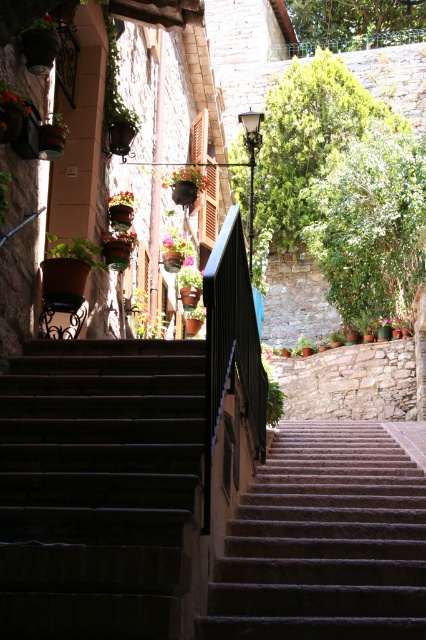
From the picture: You are standing at the base of the narrow stone staircase in the image. You want to take a photo of the green matte plant at left with your camera. The camera has a maximum zoom range of 50 feet. Can you capture the plant without moving closer?

The green matte plant at left and camera are 78.11 feet apart from each other. Since the camera can only zoom up to 50 feet, you cannot capture the plant without moving closer.

You are a gardener who needs to transport both the green matte plant at left and the matte orange flower pot at center to a storage room located at the bottom of the narrow stone staircase. Considering their sizes, which object should you carry first to ensure you can navigate the narrow staircase safely?

The green matte plant at left is smaller in size compared to the matte orange flower pot at center. Therefore, you should carry the green matte plant at left first to navigate the narrow staircase safely, as it takes up less space and allows easier maneuvering around the tight corners.

You are a painter setting up an easel to paint the scene. You need to choose between placing your easel on the brown stone stairs at lower left or next to the green matte plant at left. Which location offers more space for your equipment?

The brown stone stairs at lower left are wider than the green matte plant at left, so placing the easel there would provide more space for your equipment.